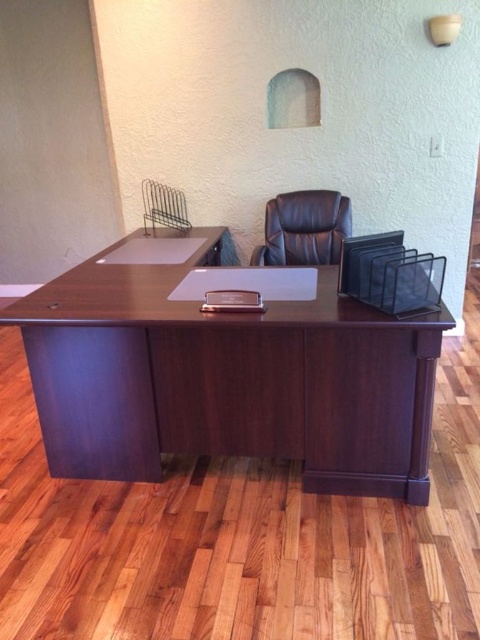
You are an office worker who needs to place a new monitor on the desk. The monitor is 20 inches wide. Can you determine if the dark wood computer desk at center has enough space for the monitor compared to the leather at center?

The dark wood computer desk at center might be wider than leather at center. If the desk is indeed wider, then there would be sufficient space for the 20 inch monitor. However, if the leather is wider, the desk might not have enough space. Please verify the actual dimensions before placing the monitor.

You are standing in the office and need to place a new lamp on the desk. The lamp requires a specific placement at coordinates point [228,380]. Is there enough space on the dark wood computer desk at center to place the lamp there?

The dark wood computer desk at center is located at point [228,380], so yes, there is space at that exact coordinate to place the lamp.

You are standing in front of the office desk and notice two points marked on the desk surface. Which point is closer to you, point (256, 321) or point (282, 205)?

Point (256, 321) is closer to the viewer than point (282, 205).